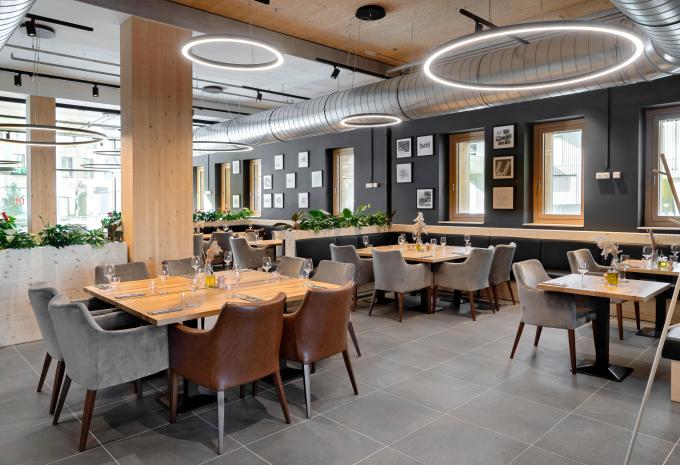
Find the location of `spotlights`. spotlights is located at coordinates (32, 29), (16, 77), (96, 88), (258, 95), (335, 73).